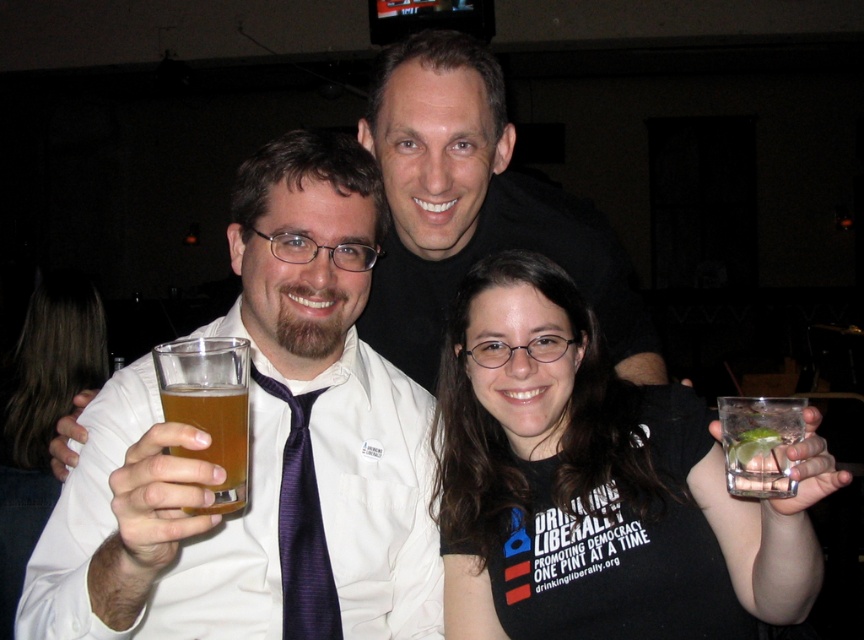
You are standing in the room and want to hand a drink to the person wearing the black matte shirt at center. Based on their position, which direction should you approach from?

The black matte shirt at center is located at point coordinates, so you should approach from the front since they are centrally positioned.

In the scene shown: You are at a party and want to hand a drink to the person wearing the black matte shirt at center. The translucent glass at left is in the way. Can you move the drink around the glass to reach the person?

The black matte shirt at center is located below the translucent glass at left, so you can move the drink around the glass by lowering it to reach the person wearing the black matte shirt at center.